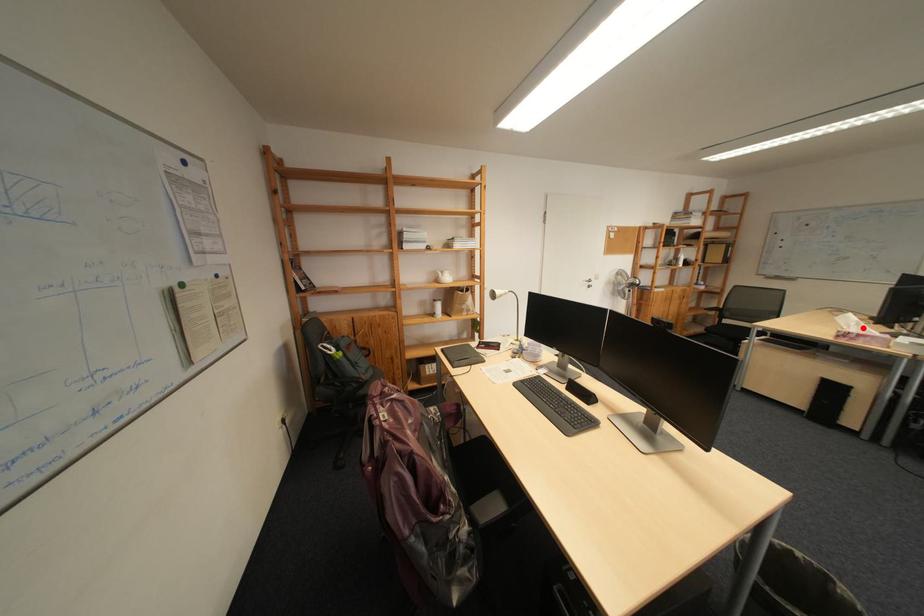
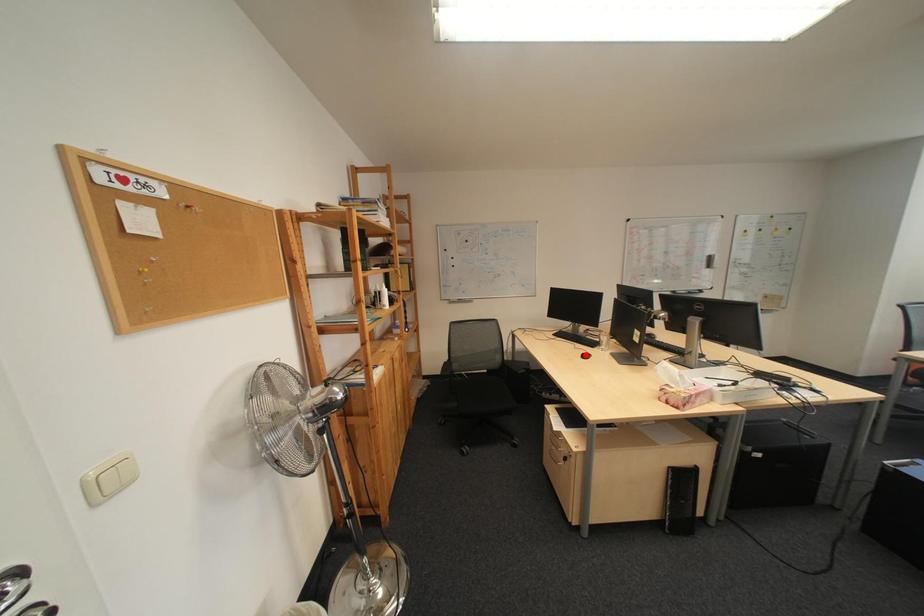
I am providing you with two images of the same scene from different viewpoints. A red point is marked on the first image and another point is marked on the second image. Is the marked point in image1 the same physical position as the marked point in image2?

No